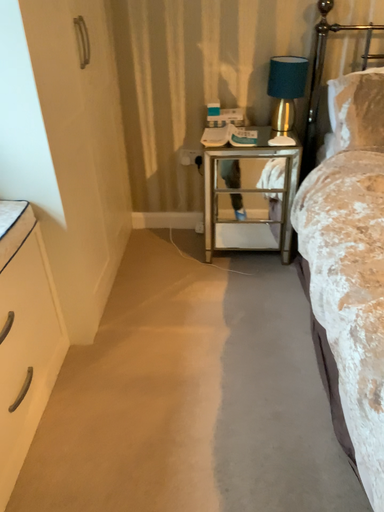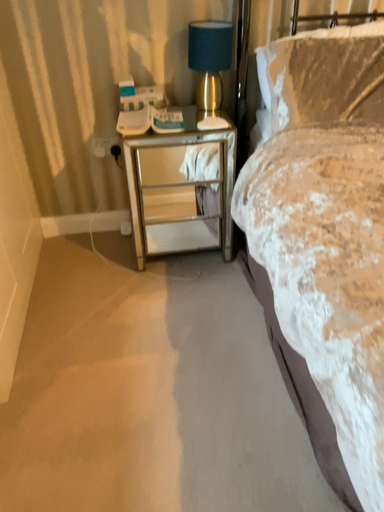
Question: How did the camera likely rotate when shooting the video?

Choices:
 (A) rotated right
 (B) rotated left

Answer: (A)